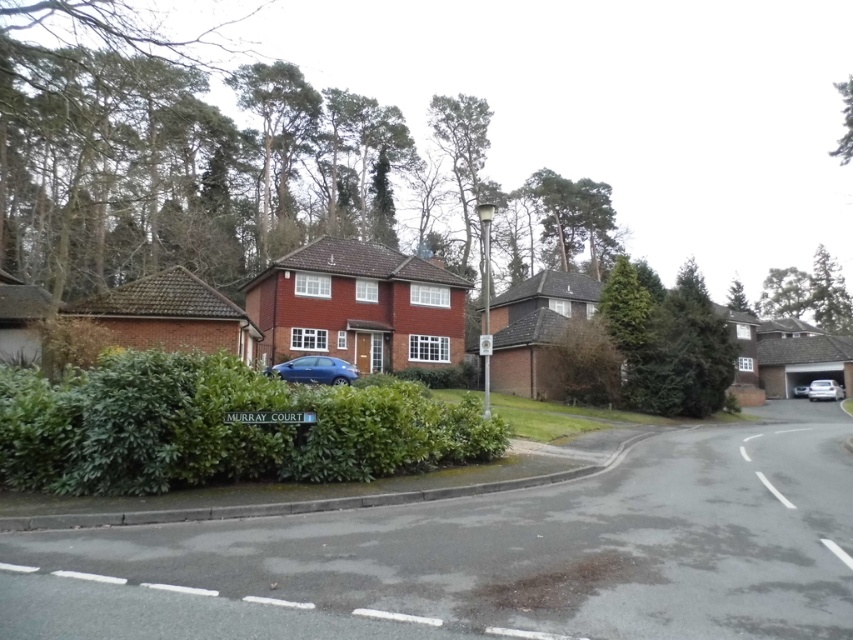
Question: Based on their relative distances, which object is farther from the green leafy hedge at center?

Choices:
 (A) glossy blue car at center
 (B) white glossy car at right
 (C) silver metallic car at right

Answer: (B)

Question: Among these points, which one is nearest to the camera?

Choices:
 (A) (798, 392)
 (B) (813, 388)

Answer: (B)

Question: Can you confirm if green leafy hedge at center is positioned to the left of glossy blue car at center?

Choices:
 (A) yes
 (B) no

Answer: (B)

Question: Does glossy blue car at center appear over white glossy car at right?

Choices:
 (A) no
 (B) yes

Answer: (B)

Question: Is the position of green leafy hedge at center more distant than that of glossy blue car at center?

Choices:
 (A) no
 (B) yes

Answer: (A)

Question: Which point appears farthest from the camera in this image?

Choices:
 (A) (802, 392)
 (B) (337, 381)
 (C) (821, 381)

Answer: (A)